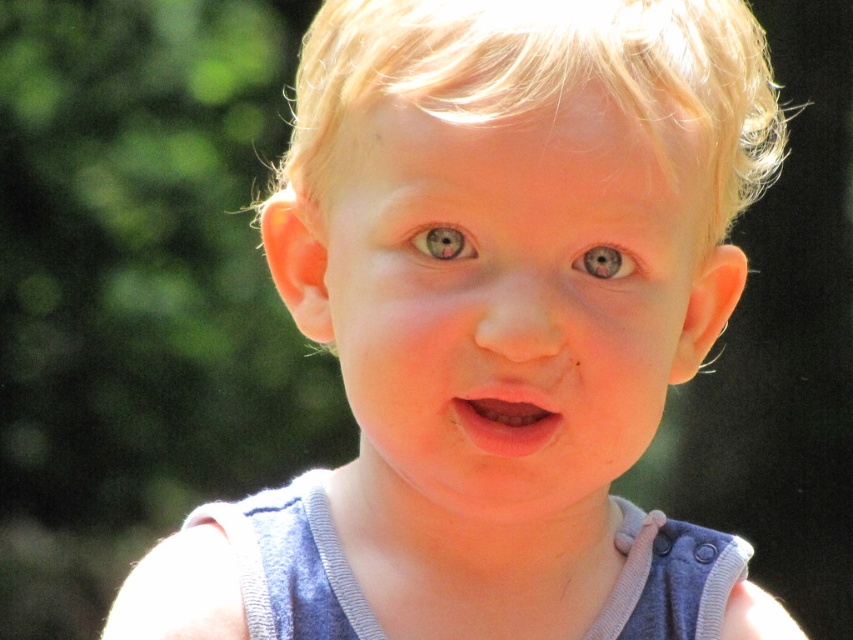
Question: Which of the following is the closest to the observer?

Choices:
 (A) matte gray eye at center
 (B) pink matte lips at center
 (C) gray matte eye at upper center
 (D) blonde silky hair at center

Answer: (D)

Question: From the image, what is the correct spatial relationship of smooth skin face at center in relation to blonde silky hair at center?

Choices:
 (A) right
 (B) left

Answer: (B)

Question: Which object appears closest to the camera in this image?

Choices:
 (A) smooth skin face at center
 (B) matte gray eye at center
 (C) gray matte eye at upper center
 (D) blonde silky hair at center

Answer: (A)

Question: Estimate the real-world distances between objects in this image. Which object is closer to the gray matte eye at upper center?

Choices:
 (A) matte gray eye at center
 (B) pink matte lips at center
 (C) blonde silky hair at center

Answer: (A)

Question: Can you confirm if pink matte lips at center is positioned below gray matte eye at upper center?

Choices:
 (A) no
 (B) yes

Answer: (B)

Question: Is pink matte lips at center wider than gray matte eye at upper center?

Choices:
 (A) no
 (B) yes

Answer: (B)